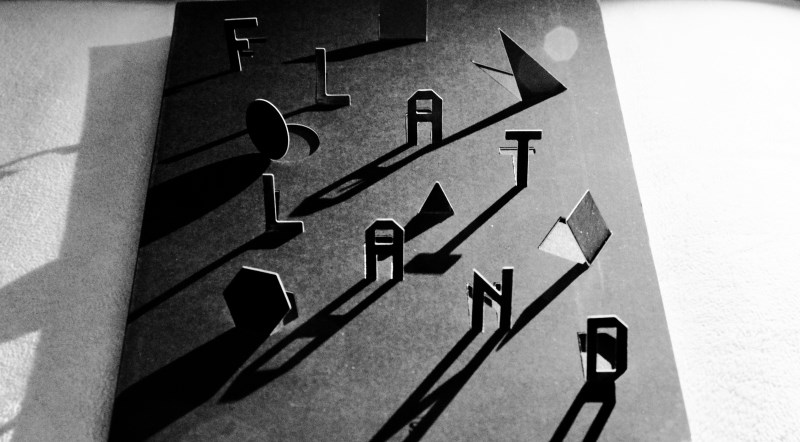
The height and width of the screenshot is (442, 800). I want to click on white surface, so click(x=750, y=175).